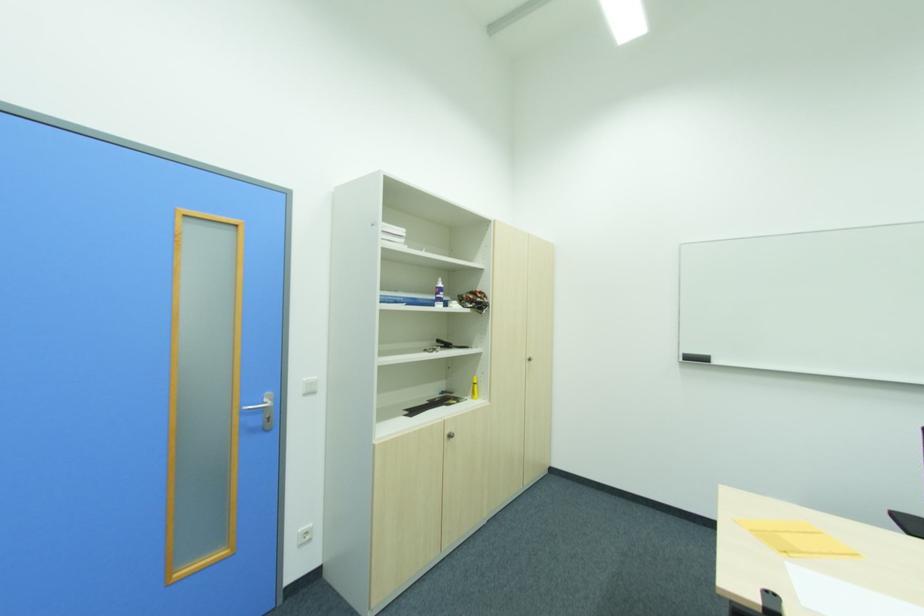
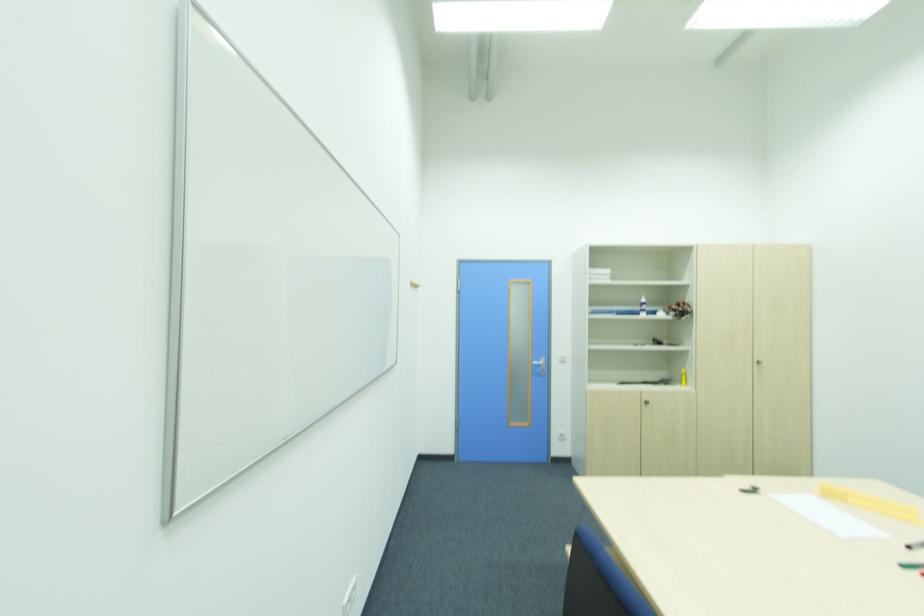
Locate, in the second image, the point that corresponds to pixel 453 437 in the first image.

(650, 402)